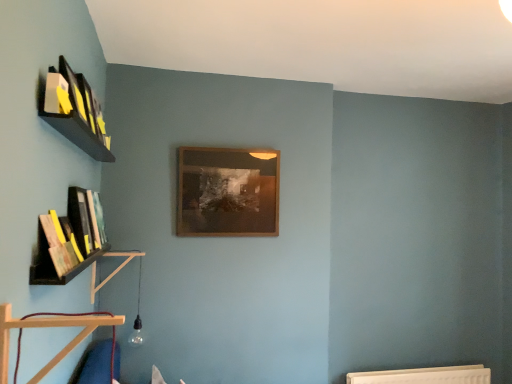
Question: From a real-world perspective, is matte yellow book at upper left, placed as the first book when sorted from top to bottom, physically above wooden at left, arranged as the first shelf when viewed from the left?

Choices:
 (A) yes
 (B) no

Answer: (A)

Question: From the image's perspective, is matte yellow book at upper left, which ranks as the first book in right-to-left order, over wooden at left, arranged as the second shelf when viewed from the front?

Choices:
 (A) no
 (B) yes

Answer: (B)

Question: Is matte yellow book at upper left, placed as the first book when sorted from top to bottom, positioned beyond the bounds of wooden at left, arranged as the first shelf when viewed from the left?

Choices:
 (A) no
 (B) yes

Answer: (B)

Question: Is matte yellow book at upper left, which ranks as the first book in right-to-left order, to the right of wooden at left, arranged as the first shelf when viewed from the left, from the viewer's perspective?

Choices:
 (A) no
 (B) yes

Answer: (B)

Question: Can you confirm if matte yellow book at upper left, which is the third book from back to front, is taller than wooden at left, arranged as the first shelf when viewed from the left?

Choices:
 (A) yes
 (B) no

Answer: (B)

Question: Is matte yellow book at upper left, which is the third book from back to front, positioned behind wooden at left, arranged as the second shelf when viewed from the front?

Choices:
 (A) yes
 (B) no

Answer: (B)

Question: Does wooden at left, arranged as the second shelf when viewed from the front, contain hardcover book at left, which ranks as the 2th book in front-to-back order?

Choices:
 (A) yes
 (B) no

Answer: (B)

Question: Does wooden at left, arranged as the second shelf when viewed from the front, have a lesser width compared to hardcover book at left, the 2th book ordered from the bottom?

Choices:
 (A) no
 (B) yes

Answer: (A)

Question: From a real-world perspective, is wooden at left, the first shelf in the back-to-front sequence, located higher than hardcover book at left, the second book from the top?

Choices:
 (A) yes
 (B) no

Answer: (B)

Question: Does wooden at left, arranged as the first shelf when viewed from the left, come in front of hardcover book at left, acting as the 2th book starting from the back?

Choices:
 (A) yes
 (B) no

Answer: (B)

Question: From the image's perspective, would you say wooden at left, the second shelf in the right-to-left sequence, is shown under hardcover book at left, the 2th book in the left-to-right sequence?

Choices:
 (A) yes
 (B) no

Answer: (A)

Question: Is wooden at left, arranged as the second shelf when viewed from the front, positioned beyond the bounds of hardcover book at left, the 2th book from the right?

Choices:
 (A) yes
 (B) no

Answer: (A)

Question: Is wooden at left, arranged as the first shelf when viewed from the left, further to camera compared to wooden at lower left, acting as the first shelf starting from the front?

Choices:
 (A) yes
 (B) no

Answer: (A)